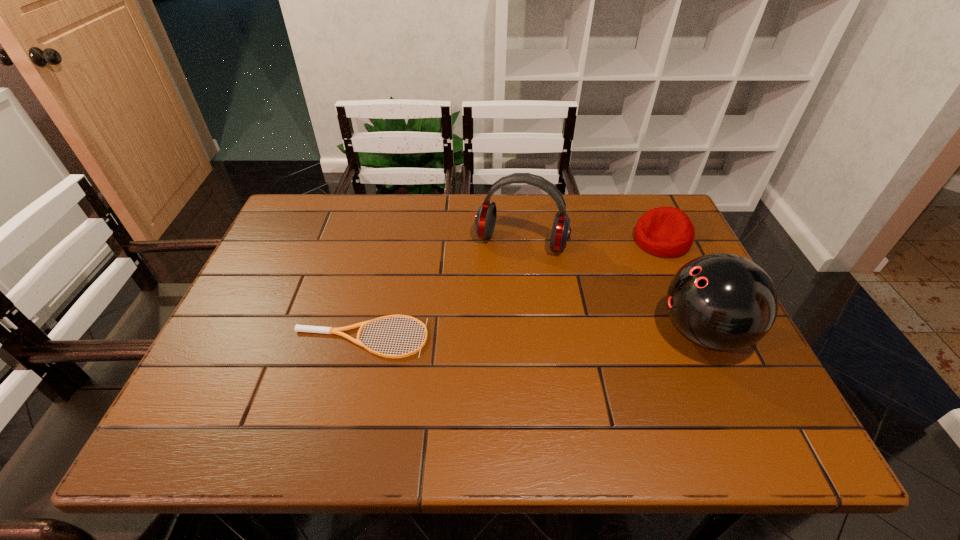
At what (x,y) coordinates should I click in order to perform the action: click on vacant space that's between the second object from left to right and the shortest object. Please return your answer as a coordinate pair (x, y). Looking at the image, I should click on (441, 290).

The width and height of the screenshot is (960, 540). I want to click on vacant region between the second shortest object and the earphone, so click(x=591, y=241).

Locate an element on the screen. blank region between the third object from right to left and the tennis racket is located at coordinates (441, 290).

Where is `vacant region between the earphone and the tennis racket`? vacant region between the earphone and the tennis racket is located at coordinates (441, 290).

Find the location of a particular element. The image size is (960, 540). free space that is in between the beanbag and the tennis racket is located at coordinates (512, 289).

The width and height of the screenshot is (960, 540). In order to click on object that ranks as the closest to the bowling ball in this screenshot , I will do `click(668, 232)`.

I want to click on object that can be found as the second closest to the bowling ball, so click(485, 219).